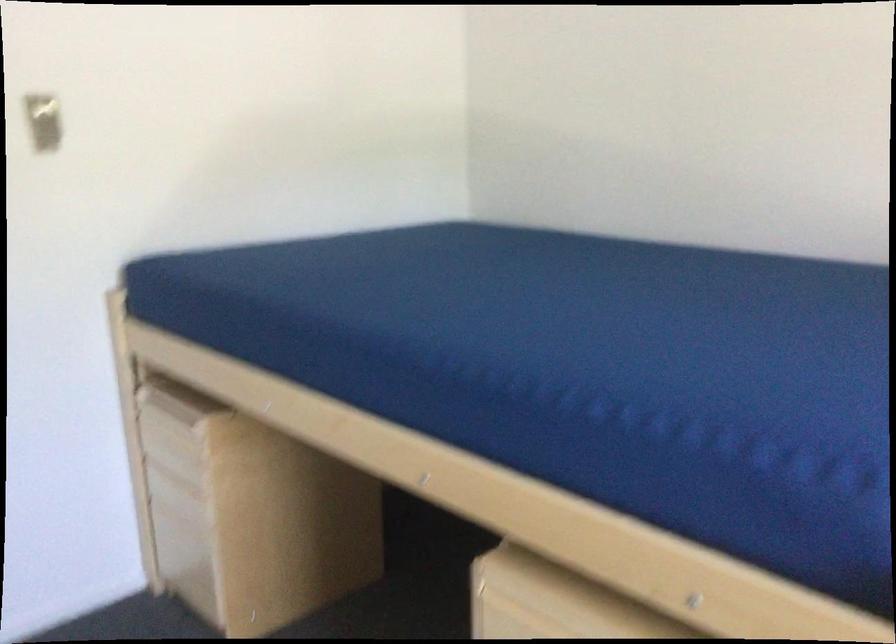
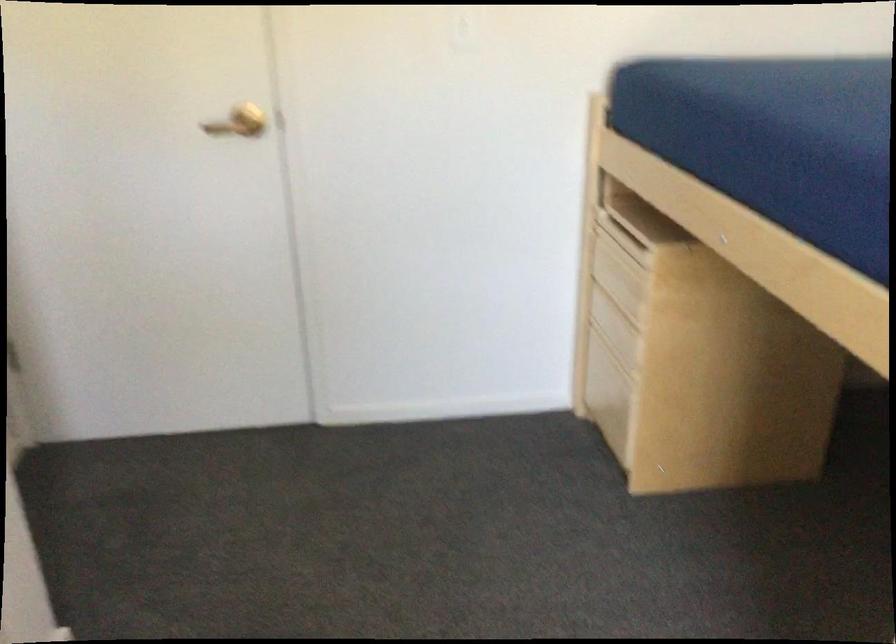
Question: The images are taken continuously from a first-person perspective. In which direction is your viewpoint rotating?

Choices:
 (A) Left
 (B) Right
 (C) Up
 (D) Down

Answer: (A)